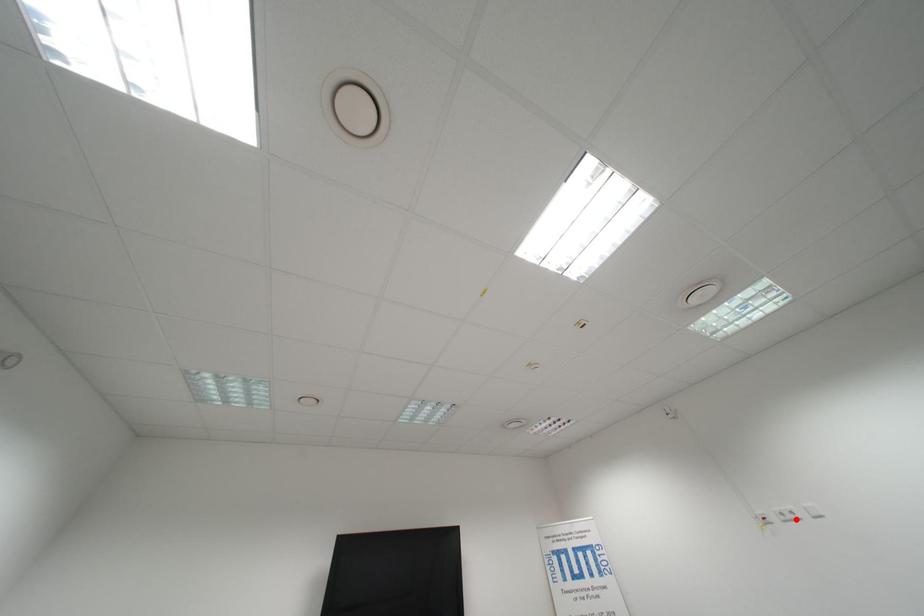
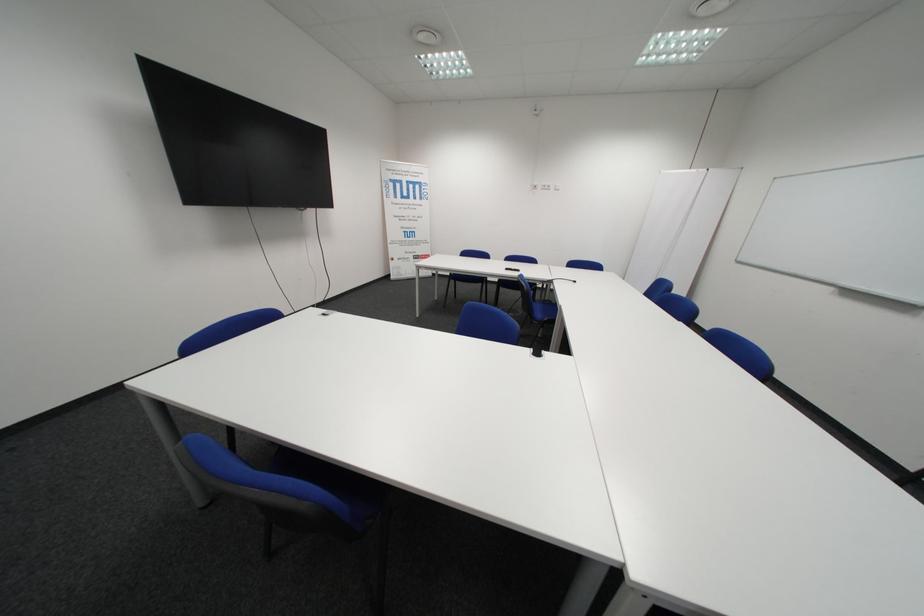
The point at the highlighted location is marked in the first image. Where is the corresponding point in the second image?

(554, 188)